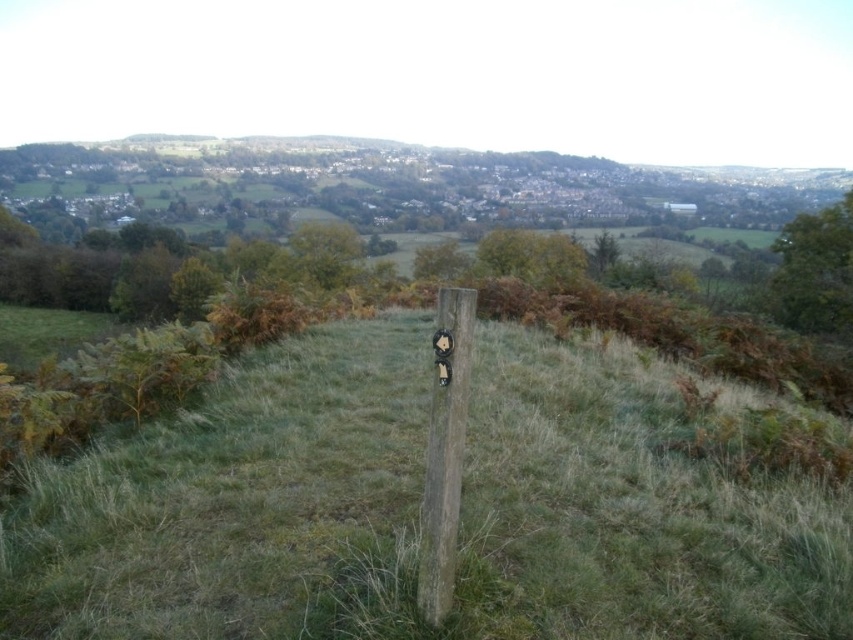
Question: Which point appears farthest from the camera in this image?

Choices:
 (A) (229, 520)
 (B) (434, 412)

Answer: (A)

Question: Among these points, which one is nearest to the camera?

Choices:
 (A) (432, 552)
 (B) (234, 616)

Answer: (A)

Question: From the image, what is the correct spatial relationship of green grassy at center in relation to wooden post at center?

Choices:
 (A) left
 (B) right

Answer: (B)

Question: Does green grassy at center have a greater width compared to wooden post at center?

Choices:
 (A) no
 (B) yes

Answer: (B)

Question: Can you confirm if green grassy at center is positioned to the right of wooden post at center?

Choices:
 (A) yes
 (B) no

Answer: (A)